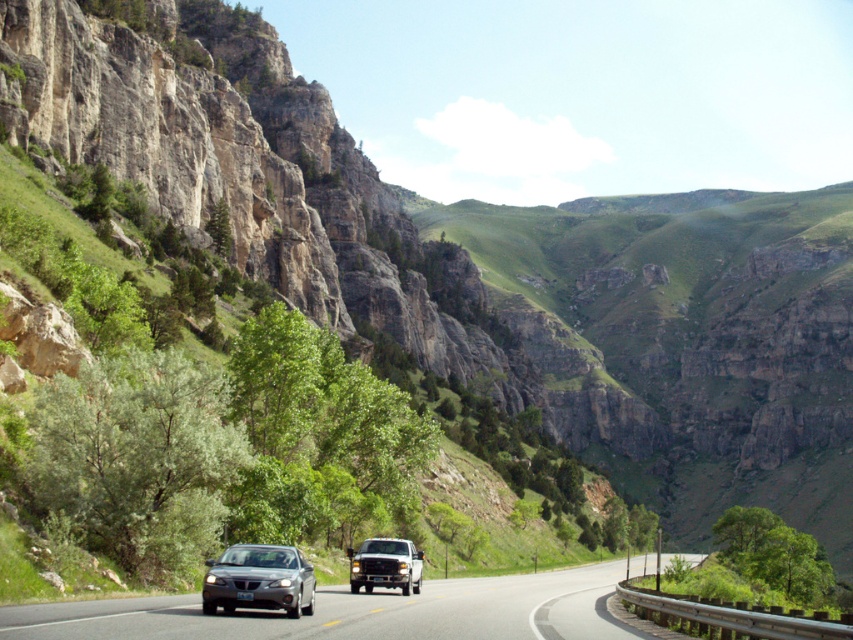
Consider the image. You are a driver approaching the scene and need to determine which vehicle is taller between the silver metallic car at center and the matte black truck at center. Based on the description, which one is taller?

The silver metallic car at center is much taller than the matte black truck at center according to the description.

You are a driver approaching the silver metallic car at center on the mountain road. The road ahead curves to the right, and there is a metal guardrail on your right side. You need to overtake the car but must ensure there is enough space. If your vehicle requires 30 meters to safely overtake, can you do so based on the distance shown?

The silver metallic car at center is 31.06 meters away from the camera. Since your vehicle needs 30 meters to safely overtake, you have enough distance to perform the maneuver safely.

You are driving a car and see the satin silver sedan at center and the matte black truck at center on the road. Which vehicle is closer to you?

The satin silver sedan at center is closer to you because it is positioned in front of the matte black truck at center.